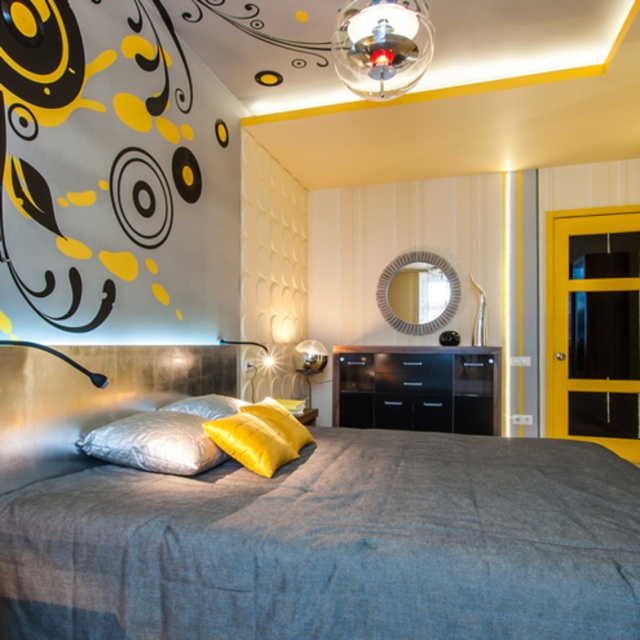
Question: Among these points, which one is nearest to the camera?

Choices:
 (A) (419, 348)
 (B) (164, 464)
 (C) (308, 349)
 (D) (273, 426)

Answer: (B)

Question: Does yellow velvet pillow at center have a smaller size compared to silver/textured pillow at center?

Choices:
 (A) yes
 (B) no

Answer: (B)

Question: Which object is farther from the camera taking this photo?

Choices:
 (A) black glossy dresser at center
 (B) silver/textured pillow at center
 (C) transparent glass sphere at upper center

Answer: (A)

Question: Can you confirm if transparent glass sphere at upper center is positioned below yellow satin pillow at center?

Choices:
 (A) yes
 (B) no

Answer: (B)

Question: Does satin silver pillow at center lie in front of matte black lamp at left?

Choices:
 (A) no
 (B) yes

Answer: (A)

Question: Which point is closer to the camera?

Choices:
 (A) matte black lamp at left
 (B) transparent glass sphere at upper center
 (C) textured gray bed at center
 (D) yellow velvet pillow at center

Answer: (C)